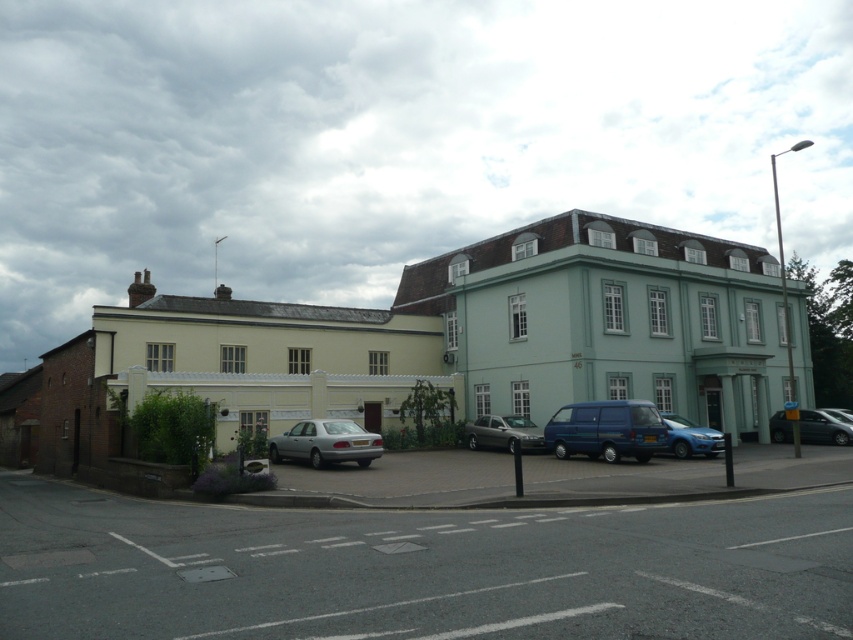
This screenshot has height=640, width=853. In order to click on metallic silver car at lower right in this screenshot , I will do `click(822, 428)`.

Is metallic silver car at lower right taller than metallic blue hatchback at lower right?

Indeed, metallic silver car at lower right has a greater height compared to metallic blue hatchback at lower right.

Image resolution: width=853 pixels, height=640 pixels. What do you see at coordinates (822, 428) in the screenshot?
I see `metallic silver car at lower right` at bounding box center [822, 428].

I want to click on metallic silver car at lower right, so click(x=822, y=428).

Is gray asphalt parking lot at lower left taller than metallic blue hatchback at lower right?

Yes, gray asphalt parking lot at lower left is taller than metallic blue hatchback at lower right.

Between gray asphalt parking lot at lower left and metallic blue hatchback at lower right, which one is positioned higher?

metallic blue hatchback at lower right is higher up.

Between point (677, 515) and point (662, 416), which one is positioned behind?

Positioned behind is point (662, 416).

Where is `gray asphalt parking lot at lower left`? The height and width of the screenshot is (640, 853). gray asphalt parking lot at lower left is located at coordinates (421, 568).

Between point (289, 436) and point (672, 432), which one is positioned behind?

The point (672, 432) is behind.

Locate an element on the screen. The image size is (853, 640). satin silver sedan at lower left is located at coordinates click(325, 442).

The width and height of the screenshot is (853, 640). What do you see at coordinates (325, 442) in the screenshot?
I see `satin silver sedan at lower left` at bounding box center [325, 442].

Find the location of a particular element. satin silver sedan at lower left is located at coordinates (325, 442).